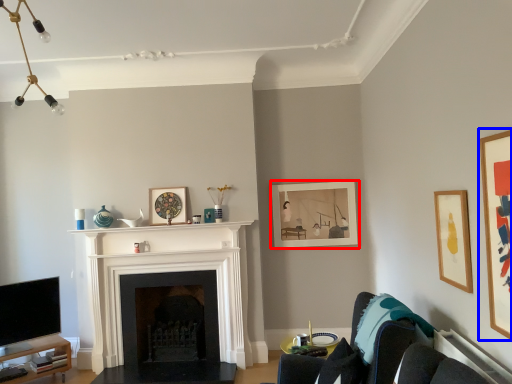
Question: Which object appears closest to the camera in this image, picture frame (highlighted by a red box) or picture frame (highlighted by a blue box)?

Choices:
 (A) picture frame
 (B) picture frame

Answer: (B)